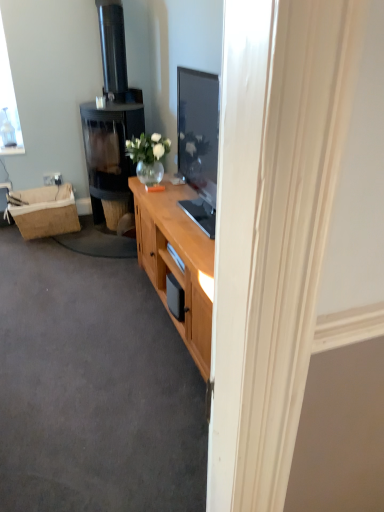
This screenshot has width=384, height=512. Identify the location of empty space that is ontop of wooden cabinet at center (from a real-world perspective). click(x=100, y=327).